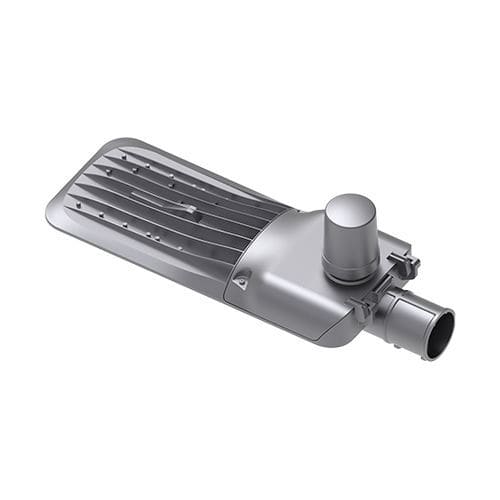
In order to click on space below mirror in this screenshot , I will do `click(130, 329)`.